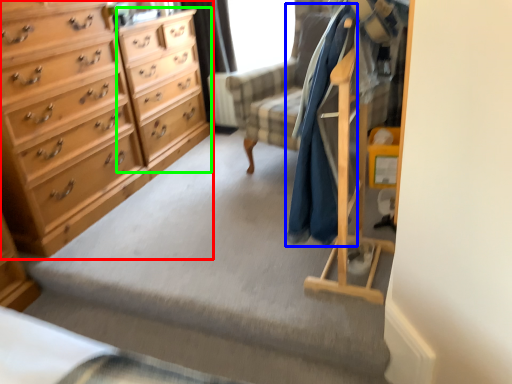
Question: Which object is positioned closest to chest of drawers (highlighted by a red box)? Select from clothing (highlighted by a blue box) and file cabinet (highlighted by a green box).

Choices:
 (A) clothing
 (B) file cabinet

Answer: (B)